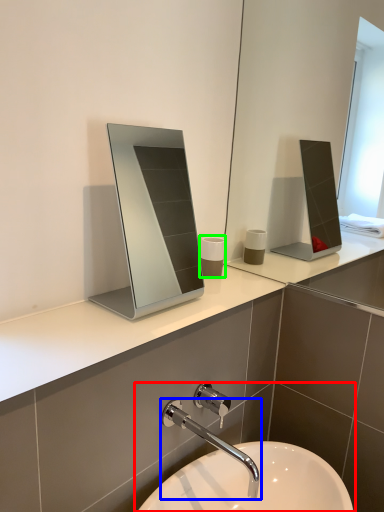
Question: Based on their relative distances, which object is nearer to sink (highlighted by a red box)? Choose from tap (highlighted by a blue box) and toiletry (highlighted by a green box).

Choices:
 (A) tap
 (B) toiletry

Answer: (A)